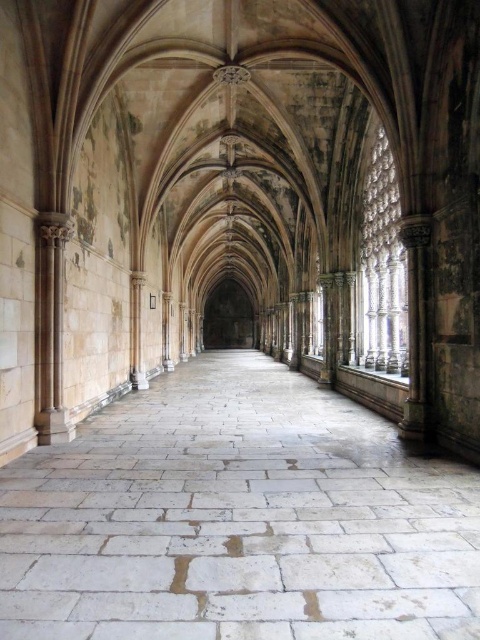
Between white stone floor at center and light beige stone column at left, which one has more height?

light beige stone column at left

Who is more forward, (311, 582) or (59, 236)?

Point (311, 582)

Locate an element on the screen. The image size is (480, 640). white stone floor at center is located at coordinates (238, 518).